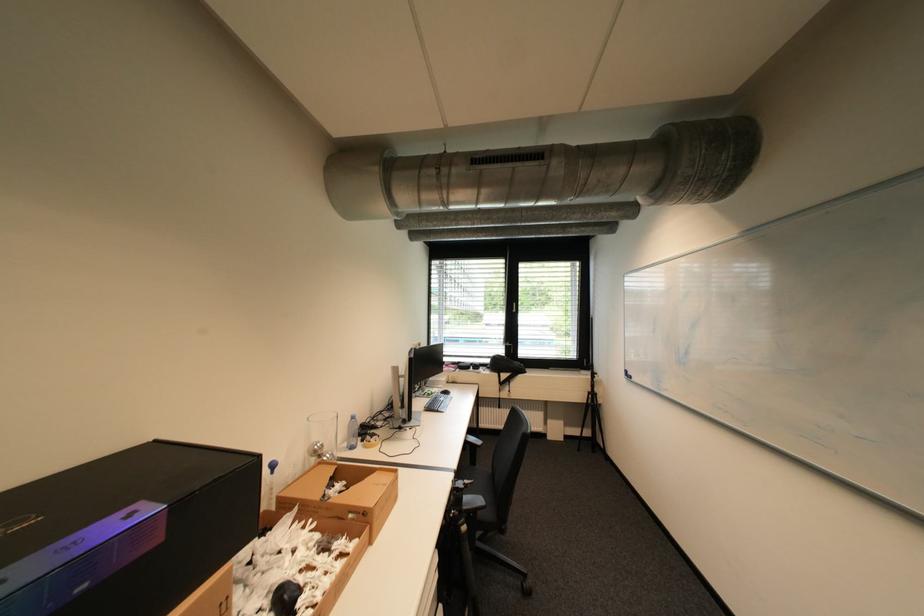
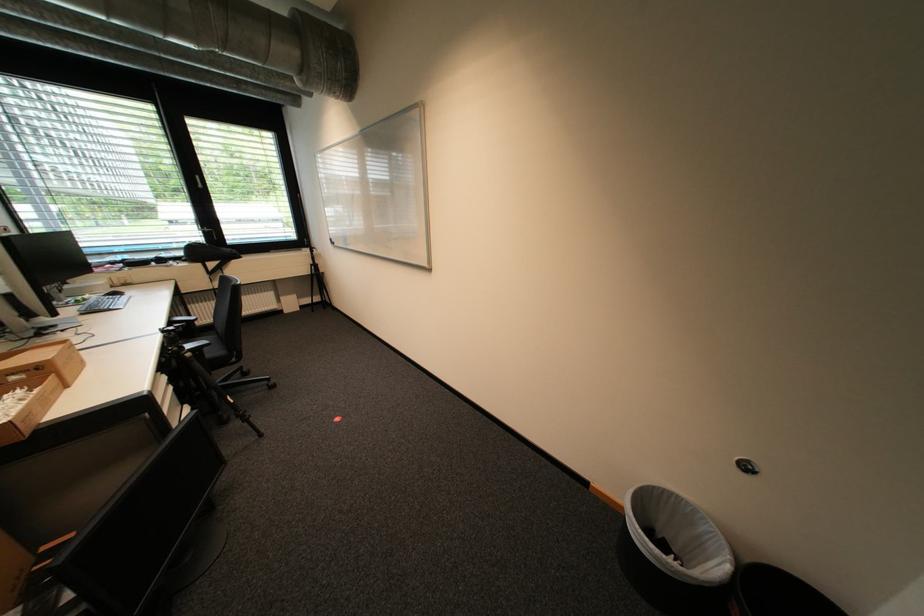
In the second image, find the point that corresponds to point 472,485 in the first image.

(184, 328)